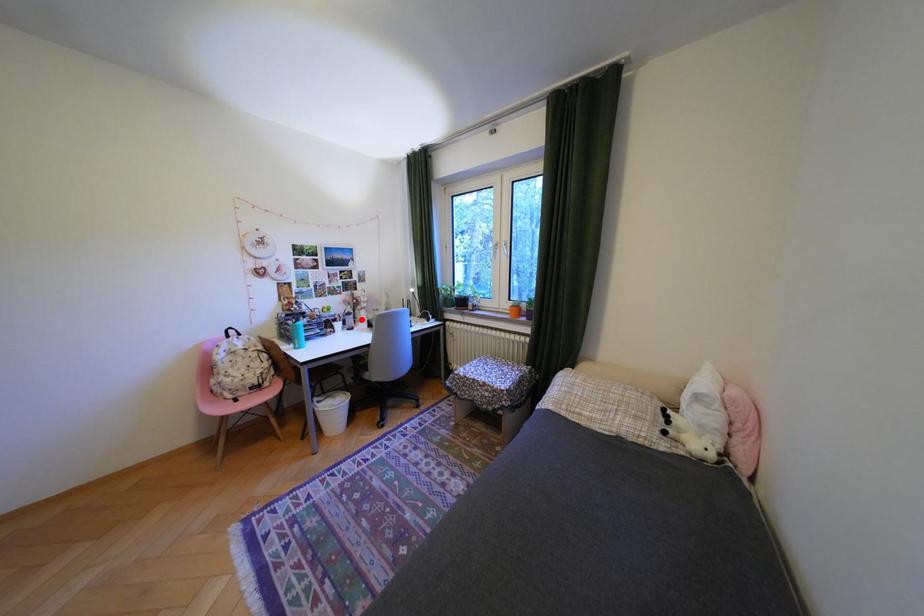
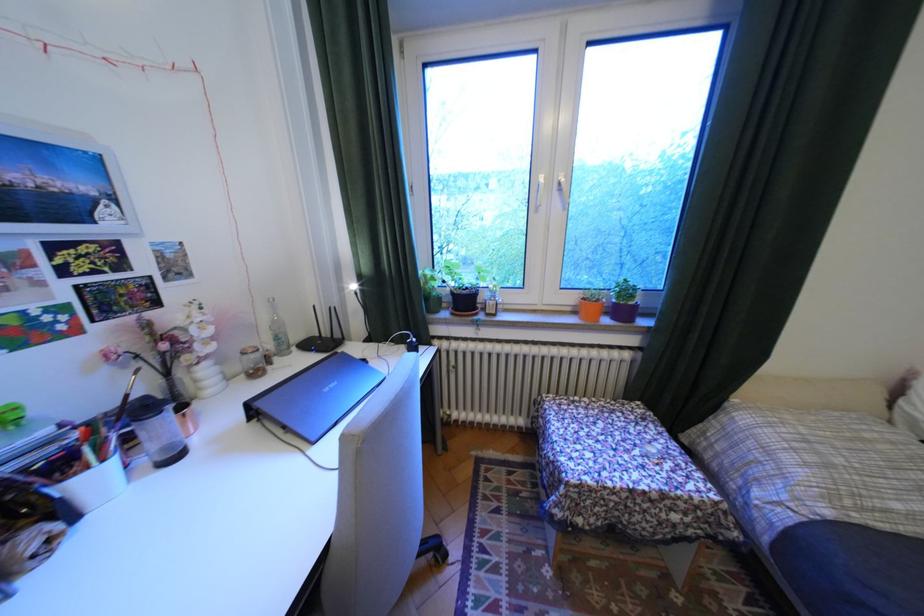
Question: I am providing you with two images of the same scene from different viewpoints. A red point is shown in image1. For the corresponding object point in image2, is it positioned nearer or farther from the camera?

Choices:
 (A) Nearer
 (B) Farther

Answer: (A)